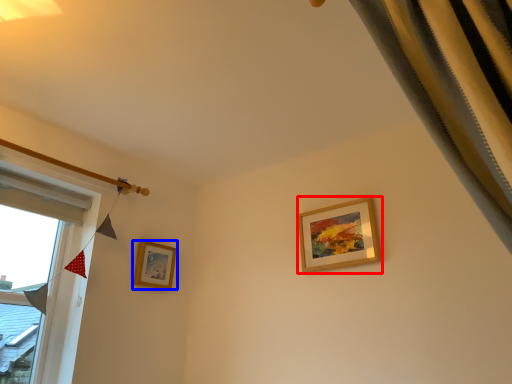
Question: Which point is closer to the camera, picture frame (highlighted by a red box) or picture frame (highlighted by a blue box)?

Choices:
 (A) picture frame
 (B) picture frame

Answer: (A)